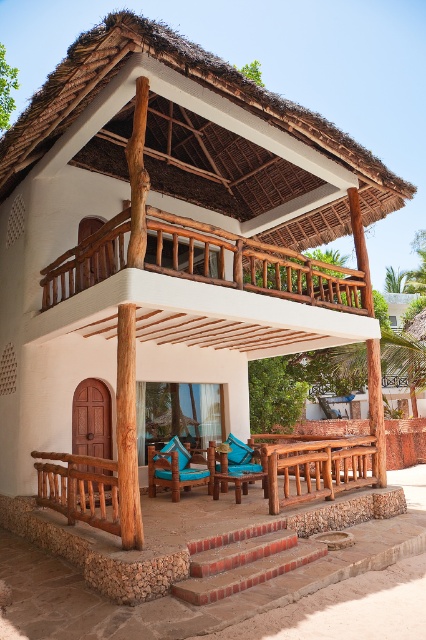
Question: Where is brick stairs at lower center located in relation to brown wooden bench at lower center in the image?

Choices:
 (A) right
 (B) left

Answer: (B)

Question: Which object appears closest to the camera in this image?

Choices:
 (A) brown wooden bench at lower center
 (B) brick stairs at lower center

Answer: (B)

Question: Can you confirm if brick stairs at lower center is positioned to the right of brown wooden bench at lower center?

Choices:
 (A) yes
 (B) no

Answer: (B)

Question: Which is farther from the brick stairs at lower center?

Choices:
 (A) brown wooden bench at lower center
 (B) wooden at upper center

Answer: (B)

Question: Which point is farther to the camera?

Choices:
 (A) (319, 492)
 (B) (212, 243)
 (C) (279, 570)

Answer: (A)

Question: Can you confirm if wooden at upper center is thinner than brown wooden bench at lower center?

Choices:
 (A) yes
 (B) no

Answer: (B)